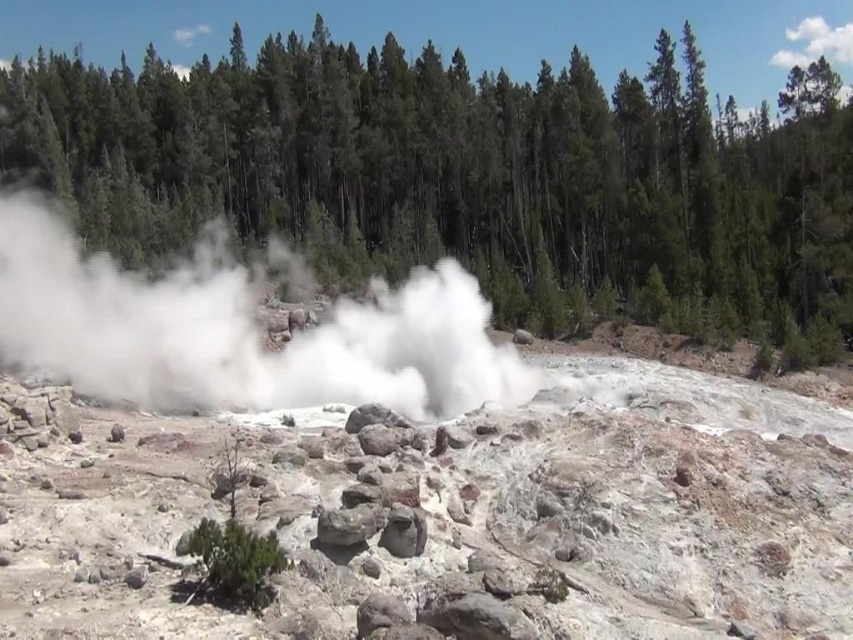
Question: Is green textured trees at center thinner than white vapor at center?

Choices:
 (A) no
 (B) yes

Answer: (A)

Question: Among these objects, which one is nearest to the camera?

Choices:
 (A) white vapor at center
 (B) green textured trees at center

Answer: (A)

Question: Does green textured trees at center appear over white vapor at center?

Choices:
 (A) yes
 (B) no

Answer: (A)

Question: Is green textured trees at center smaller than white vapor at center?

Choices:
 (A) yes
 (B) no

Answer: (B)